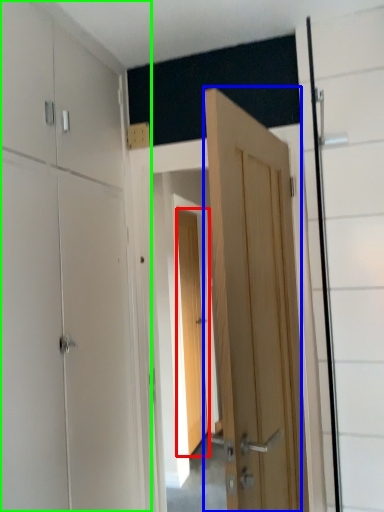
Question: Based on their relative distances, which object is farther from door (highlighted by a red box)? Choose from door (highlighted by a blue box) and dresser (highlighted by a green box).

Choices:
 (A) door
 (B) dresser

Answer: (A)